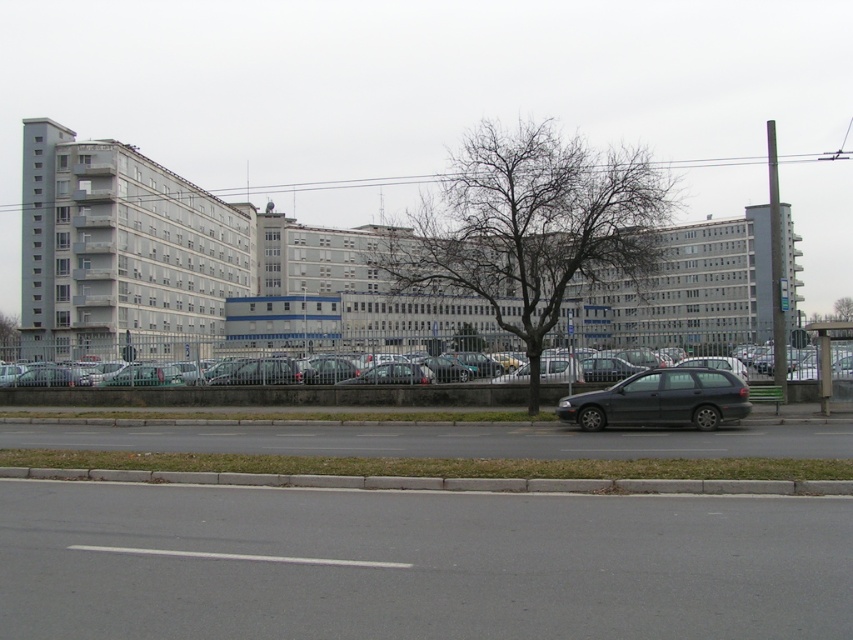
You are a delivery driver who needs to park your truck between the silver metallic sedan at center and the matte black station wagon at center. However, the parking space between them is only 1.2 meters wide. Your truck is 1.5 meters wide. Can you fit your truck between them?

The silver metallic sedan at center is located above the matte black station wagon at center, meaning they are positioned vertically rather than horizontally. Since the parking space width is 1.2 meters and your truck is 1.5 meters wide, you cannot fit your truck between them horizontally. Consider finding another parking spot.